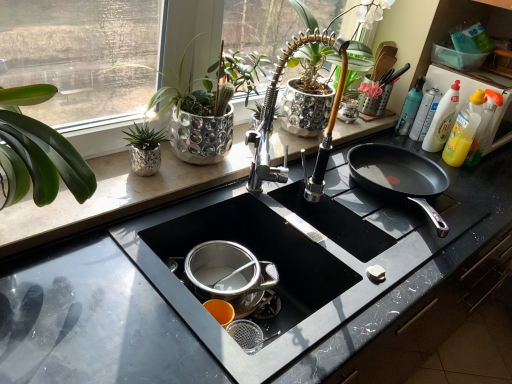
Question: Is translucent plastic bottle at upper right not close to translucent plastic bottle at upper right?

Choices:
 (A) yes
 (B) no

Answer: (B)

Question: From the image's perspective, is translucent plastic bottle at upper right located beneath translucent plastic bottle at upper right?

Choices:
 (A) yes
 (B) no

Answer: (A)

Question: Considering the relative positions of translucent plastic bottle at upper right and translucent plastic bottle at upper right in the image provided, is translucent plastic bottle at upper right in front of translucent plastic bottle at upper right?

Choices:
 (A) yes
 (B) no

Answer: (A)

Question: Can you confirm if translucent plastic bottle at upper right is bigger than translucent plastic bottle at upper right?

Choices:
 (A) yes
 (B) no

Answer: (A)

Question: From the image's perspective, is translucent plastic bottle at upper right on top of translucent plastic bottle at upper right?

Choices:
 (A) no
 (B) yes

Answer: (A)

Question: Do you think black granite countertop at center is within black marble countertop at center, or outside of it?

Choices:
 (A) outside
 (B) inside

Answer: (A)

Question: In terms of size, does black granite countertop at center appear bigger or smaller than black marble countertop at center?

Choices:
 (A) small
 (B) big

Answer: (A)

Question: In terms of height, does black granite countertop at center look taller or shorter compared to black marble countertop at center?

Choices:
 (A) short
 (B) tall

Answer: (A)

Question: Would you say black granite countertop at center is to the left or to the right of black marble countertop at center in the picture?

Choices:
 (A) right
 (B) left

Answer: (B)

Question: Would you say black marble countertop at center is inside or outside yellow plastic bottle at right?

Choices:
 (A) inside
 (B) outside

Answer: (B)

Question: Does point (88, 299) appear closer or farther from the camera than point (504, 107)?

Choices:
 (A) closer
 (B) farther

Answer: (A)

Question: In terms of width, does black marble countertop at center look wider or thinner when compared to yellow plastic bottle at right?

Choices:
 (A) thin
 (B) wide

Answer: (B)

Question: Considering the positions of black marble countertop at center and yellow plastic bottle at right in the image, is black marble countertop at center bigger or smaller than yellow plastic bottle at right?

Choices:
 (A) small
 (B) big

Answer: (B)

Question: From their relative heights in the image, would you say silver textured pot at upper left, which ranks as the second houseplant in left-to-right order, is taller or shorter than yellow plastic bottle at right?

Choices:
 (A) short
 (B) tall

Answer: (B)

Question: Considering the relative positions of silver textured pot at upper left, which ranks as the second houseplant in left-to-right order, and yellow plastic bottle at right in the image provided, is silver textured pot at upper left, which ranks as the second houseplant in left-to-right order, to the left or to the right of yellow plastic bottle at right?

Choices:
 (A) right
 (B) left

Answer: (B)